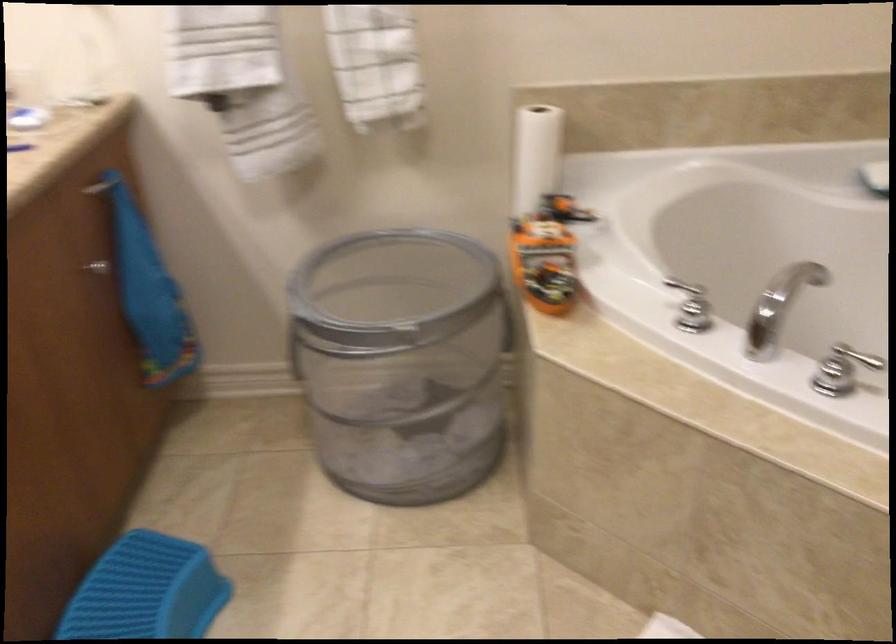
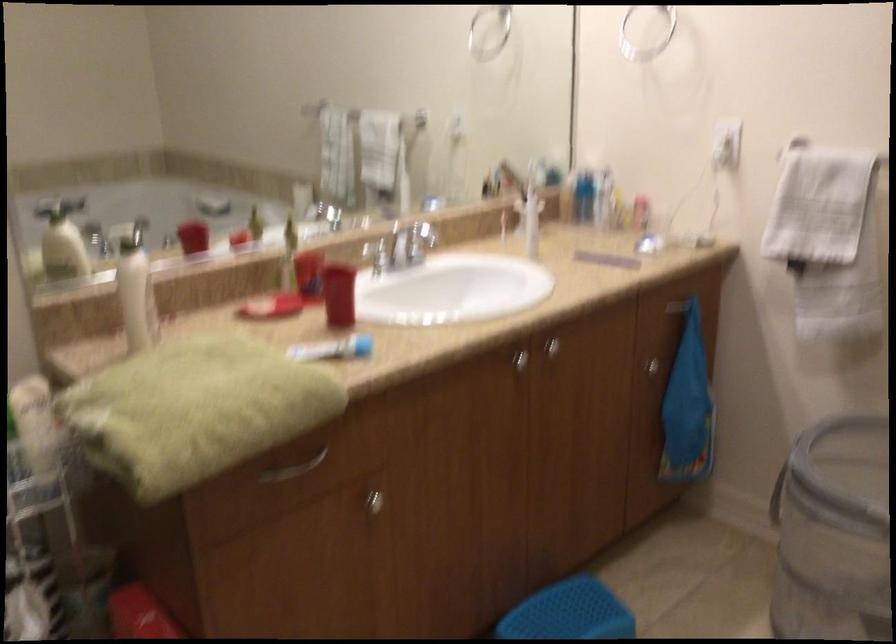
Locate, in the second image, the point that corresponds to [99,270] in the first image.

(650, 366)